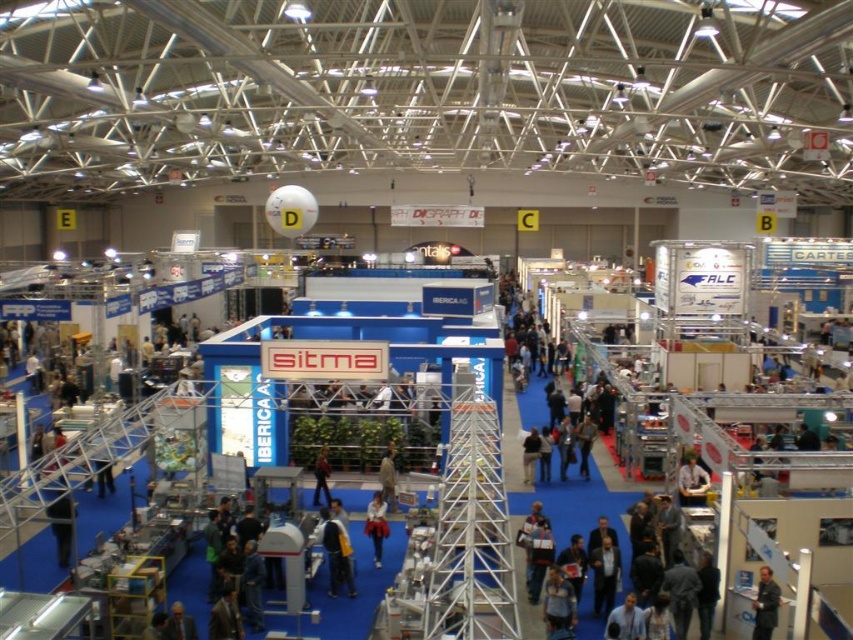
Question: Can you confirm if dark blue jacket at center is bigger than brown leather jacket at center?

Choices:
 (A) no
 (B) yes

Answer: (B)

Question: Which of the following is the closest to the observer?

Choices:
 (A) dark blue jeans at center
 (B) dark blue shirt at center
 (C) white fabric shirt at center

Answer: (B)

Question: Among these points, which one is farthest from the camera?

Choices:
 (A) (393, 509)
 (B) (366, 525)
 (C) (316, 477)

Answer: (C)

Question: Can you confirm if dark blue jacket at center is thinner than white fabric shirt at center?

Choices:
 (A) yes
 (B) no

Answer: (B)

Question: Among these points, which one is nearest to the camera?

Choices:
 (A) (334, 588)
 (B) (316, 477)
 (C) (379, 508)
 (D) (769, 582)

Answer: (D)

Question: Can you confirm if dark blue jacket at center is thinner than dark blue jeans at center?

Choices:
 (A) yes
 (B) no

Answer: (B)